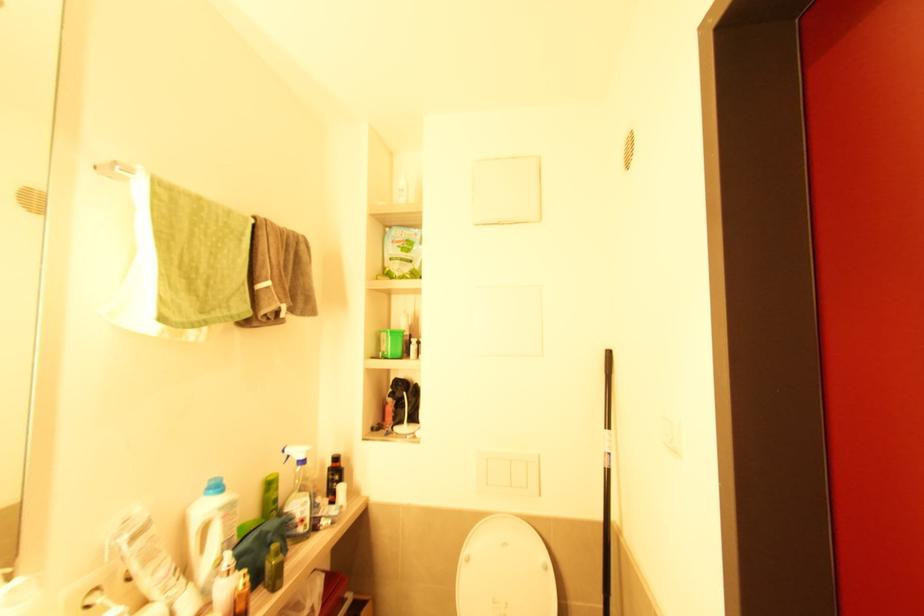
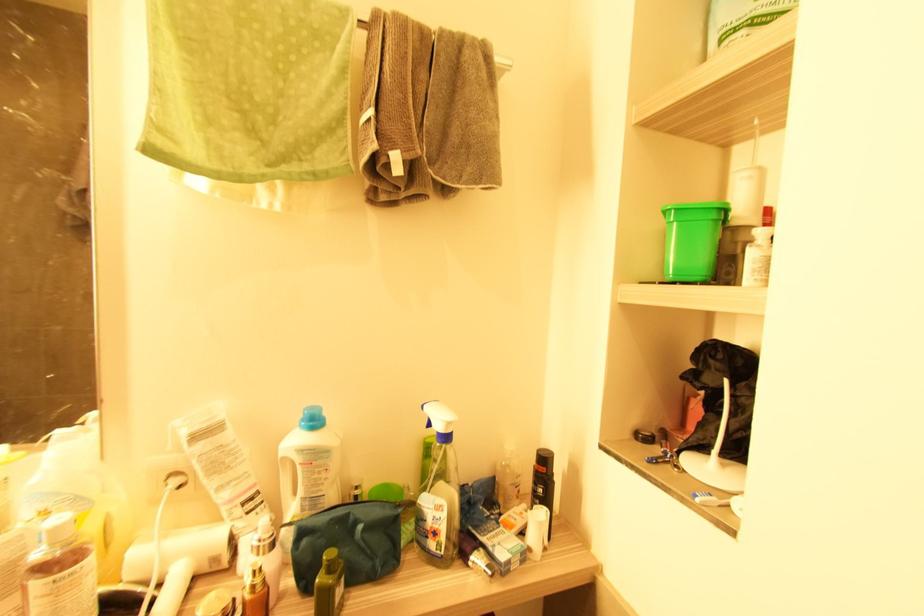
Find the pixel in the second image that matches [278,554] in the first image.

(331, 572)